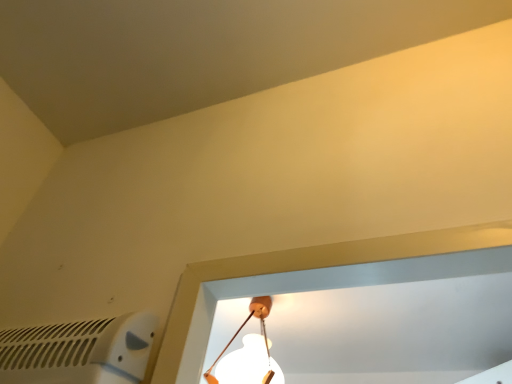
I want to click on white matte lamp at center, so click(x=249, y=354).

The image size is (512, 384). Describe the element at coordinates (249, 354) in the screenshot. I see `white matte lamp at center` at that location.

You are a GUI agent. You are given a task and a screenshot of the screen. Output one action in this format:
    pyautogui.click(x=<x>, y=<y>)
    Task: Click on the white plastic air conditioning at lower left
    
    Given the screenshot: What is the action you would take?
    pyautogui.click(x=79, y=351)

This screenshot has height=384, width=512. What do you see at coordinates (79, 351) in the screenshot?
I see `white plastic air conditioning at lower left` at bounding box center [79, 351].

At what (x,y) coordinates should I click in order to perform the action: click on white matte lamp at center. Please return your answer as a coordinate pair (x, y). This screenshot has height=384, width=512. Looking at the image, I should click on (249, 354).

Is white plastic air conditioning at lower left to the left of white matte lamp at center from the viewer's perspective?

Indeed, white plastic air conditioning at lower left is positioned on the left side of white matte lamp at center.

Considering the relative positions of white plastic air conditioning at lower left and white matte lamp at center in the image provided, is white plastic air conditioning at lower left in front of white matte lamp at center?

Yes, it is in front of white matte lamp at center.

Which is nearer, [61,366] or [269,376]?

Point [61,366].

From the image's perspective, between white plastic air conditioning at lower left and white matte lamp at center, who is located below?

white matte lamp at center appears lower in the image.

From a real-world perspective, between white plastic air conditioning at lower left and white matte lamp at center, who is vertically higher?

white matte lamp at center is physically above.

From the picture: Can you confirm if white plastic air conditioning at lower left is thinner than white matte lamp at center?

Yes.

Looking at this image, between white plastic air conditioning at lower left and white matte lamp at center, which one has more height?

With more height is white matte lamp at center.

Considering the sizes of white plastic air conditioning at lower left and white matte lamp at center in the image, is white plastic air conditioning at lower left bigger or smaller than white matte lamp at center?

In the image, white plastic air conditioning at lower left appears to be smaller than white matte lamp at center.

Is white plastic air conditioning at lower left surrounding white matte lamp at center?

No.

Are white plastic air conditioning at lower left and white matte lamp at center beside each other?

They are not placed beside each other.

Consider the image. Is white plastic air conditioning at lower left positioned with its back to white matte lamp at center?

No.

What's the angular difference between white plastic air conditioning at lower left and white matte lamp at center's facing directions?

The facing directions of white plastic air conditioning at lower left and white matte lamp at center are 1.33 degrees apart.

Find the location of a particular element. Image resolution: width=512 pixels, height=384 pixels. lamp behind the white plastic air conditioning at lower left is located at coordinates (249, 354).

Does white matte lamp at center appear on the right side of white plastic air conditioning at lower left?

Correct, you'll find white matte lamp at center to the right of white plastic air conditioning at lower left.

Considering their positions, is white matte lamp at center located in front of or behind white plastic air conditioning at lower left?

In the image, white matte lamp at center appears behind white plastic air conditioning at lower left.

Which is farther, (x=265, y=335) or (x=87, y=338)?

Positioned behind is point (x=265, y=335).

From the image's perspective, is white matte lamp at center on top of white plastic air conditioning at lower left?

Incorrect, from the image's perspective, white matte lamp at center is lower than white plastic air conditioning at lower left.

From a real-world perspective, is white matte lamp at center positioned under white plastic air conditioning at lower left based on gravity?

No, from a real-world perspective, white matte lamp at center is not below white plastic air conditioning at lower left.

In the scene shown: Between white matte lamp at center and white plastic air conditioning at lower left, which one has smaller width?

white plastic air conditioning at lower left is thinner.

In terms of height, does white matte lamp at center look taller or shorter compared to white plastic air conditioning at lower left?

Clearly, white matte lamp at center is taller compared to white plastic air conditioning at lower left.

Considering the sizes of white matte lamp at center and white plastic air conditioning at lower left in the image, is white matte lamp at center bigger or smaller than white plastic air conditioning at lower left?

white matte lamp at center is bigger than white plastic air conditioning at lower left.

Is white matte lamp at center completely or partially outside of white plastic air conditioning at lower left?

Absolutely, white matte lamp at center is external to white plastic air conditioning at lower left.

Are white matte lamp at center and white plastic air conditioning at lower left located far from each other?

Yes.

Is white matte lamp at center turned away from white plastic air conditioning at lower left?

That's not correct — white matte lamp at center is not looking away from white plastic air conditioning at lower left.

How much distance is there between white matte lamp at center and white plastic air conditioning at lower left?

white matte lamp at center and white plastic air conditioning at lower left are 3.66 feet apart.

At what (x,y) coordinates should I click in order to perform the action: click on lamp that appears below the white plastic air conditioning at lower left (from the image's perspective). Please return your answer as a coordinate pair (x, y). Looking at the image, I should click on (249, 354).

I want to click on lamp above the white plastic air conditioning at lower left (from a real-world perspective), so click(249, 354).

This screenshot has width=512, height=384. In order to click on air conditioning in front of the white matte lamp at center in this screenshot , I will do `click(79, 351)`.